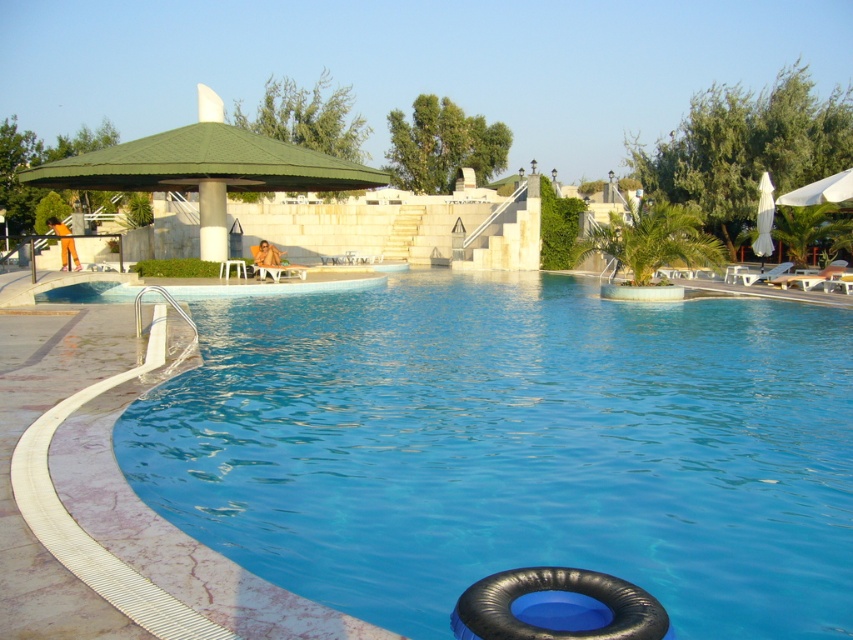
This screenshot has height=640, width=853. What do you see at coordinates (515, 449) in the screenshot?
I see `blue rubber ring at lower center` at bounding box center [515, 449].

Is point (810, 401) positioned behind point (763, 192)?

No, (810, 401) is in front of (763, 192).

Is point (384, 532) positioned after point (769, 216)?

No, it is not.

Image resolution: width=853 pixels, height=640 pixels. Identify the location of blue rubber ring at lower center. (515, 449).

Can you confirm if black rubber ring at lower center is smaller than white fabric umbrella at right?

Yes, black rubber ring at lower center is smaller than white fabric umbrella at right.

Can you confirm if black rubber ring at lower center is bigger than white fabric umbrella at right?

No, black rubber ring at lower center is not bigger than white fabric umbrella at right.

Locate an element on the screen. The width and height of the screenshot is (853, 640). black rubber ring at lower center is located at coordinates (556, 605).

Is blue rubber ring at lower center bigger than black rubber ring at lower center?

Yes.

Is blue rubber ring at lower center positioned in front of black rubber ring at lower center?

No, it is behind black rubber ring at lower center.

Between point (407, 497) and point (524, 625), which one is positioned in front?

Positioned in front is point (524, 625).

Image resolution: width=853 pixels, height=640 pixels. What are the coordinates of `blue rubber ring at lower center` in the screenshot? It's located at (515, 449).